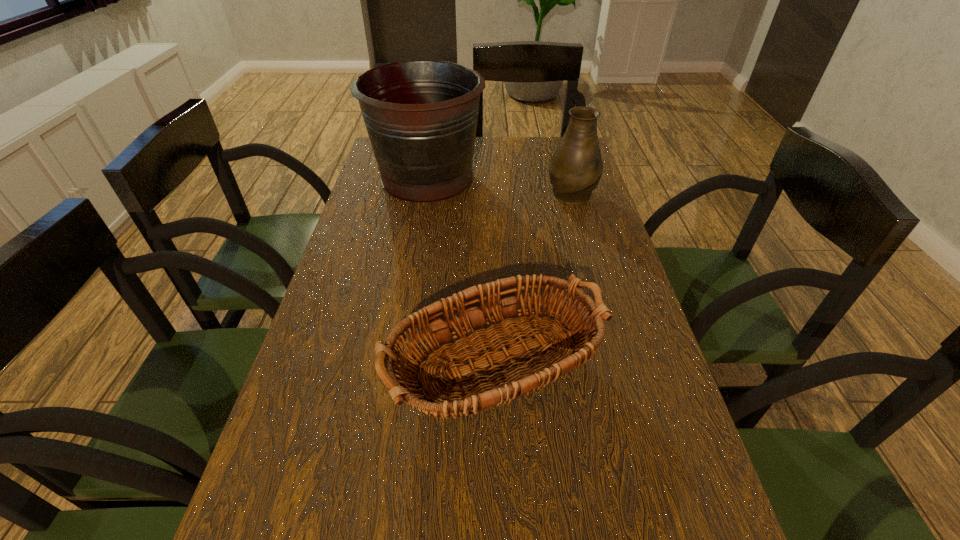
Identify the location of the tallest object. The image size is (960, 540). (421, 116).

The image size is (960, 540). Identify the location of the second tallest object. (575, 169).

You are a GUI agent. You are given a task and a screenshot of the screen. Output one action in this format:
    pyautogui.click(x=<x>, y=<y>)
    Task: Click on the nearest object
    
    Given the screenshot: What is the action you would take?
    point(521,376)

Locate an element on the screen. the shortest object is located at coordinates (521, 376).

You are a GUI agent. You are given a task and a screenshot of the screen. Output one action in this format:
    pyautogui.click(x=<x>, y=<y>)
    Task: Click on the vacant space located 0.320m on the right of the tallest object
    
    Given the screenshot: What is the action you would take?
    pyautogui.click(x=583, y=178)

Identify the location of vacant area situated on the handle side of the second shortest object. (556, 138).

Locate an element on the screen. This screenshot has width=960, height=540. vacant space situated 0.140m on the handle side of the second shortest object is located at coordinates (562, 156).

The height and width of the screenshot is (540, 960). I want to click on blank area located 0.290m on the handle side of the second shortest object, so click(556, 137).

This screenshot has height=540, width=960. I want to click on vacant area located on the left of the basket, so click(357, 370).

Where is `object present at the far edge`? This screenshot has width=960, height=540. object present at the far edge is located at coordinates (421, 116).